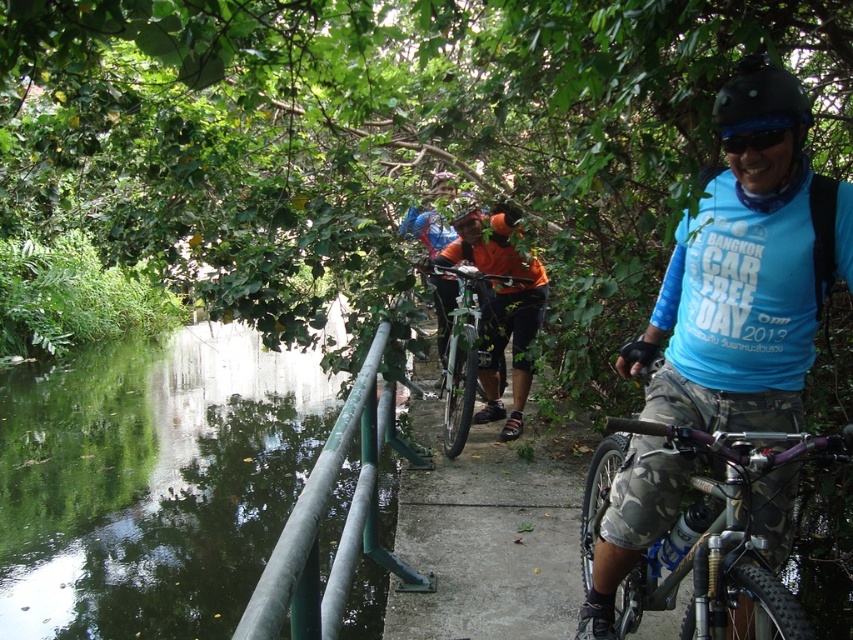
Question: Does green smooth water at lower left have a lesser width compared to shiny silver bicycle at center?

Choices:
 (A) yes
 (B) no

Answer: (B)

Question: Estimate the real-world distances between objects in this image. Which object is closer to the green smooth water at lower left?

Choices:
 (A) blue matte shirt at center
 (B) shiny silver bicycle at center

Answer: (B)

Question: Can you confirm if blue matte shirt at center is wider than black matte helmet at upper right?

Choices:
 (A) yes
 (B) no

Answer: (A)

Question: Which is nearer to the shiny silver bicycle at center?

Choices:
 (A) green painted metal railing at left
 (B) black matte helmet at upper right
 (C) blue matte shirt at center

Answer: (A)

Question: Which point appears farthest from the camera in this image?

Choices:
 (A) (67, 548)
 (B) (468, 218)
 (C) (361, 544)
 (D) (822, 232)

Answer: (A)

Question: Can you confirm if green painted metal railing at left is wider than black matte helmet at upper right?

Choices:
 (A) yes
 (B) no

Answer: (A)